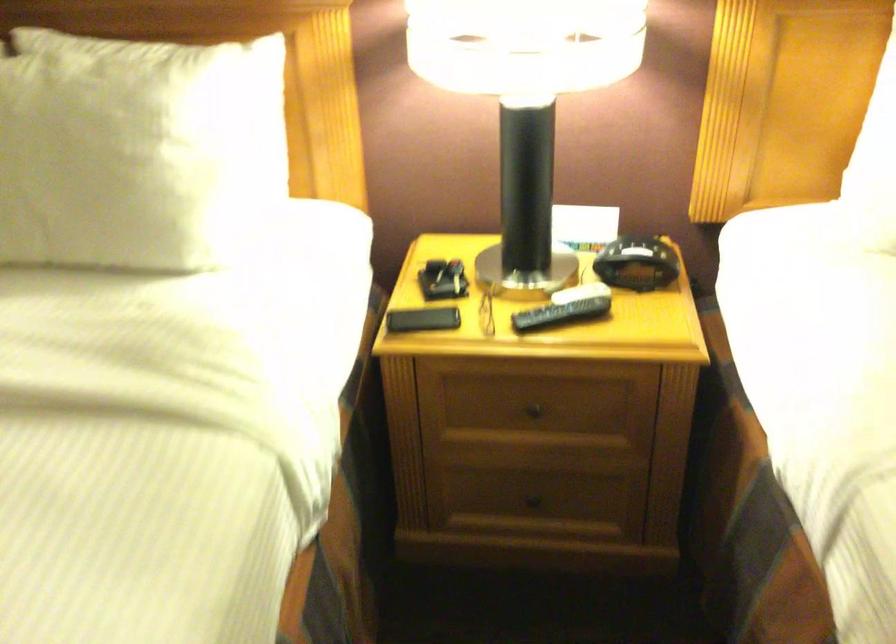
Locate an element on the screen. This screenshot has width=896, height=644. black remote control is located at coordinates (579, 292).